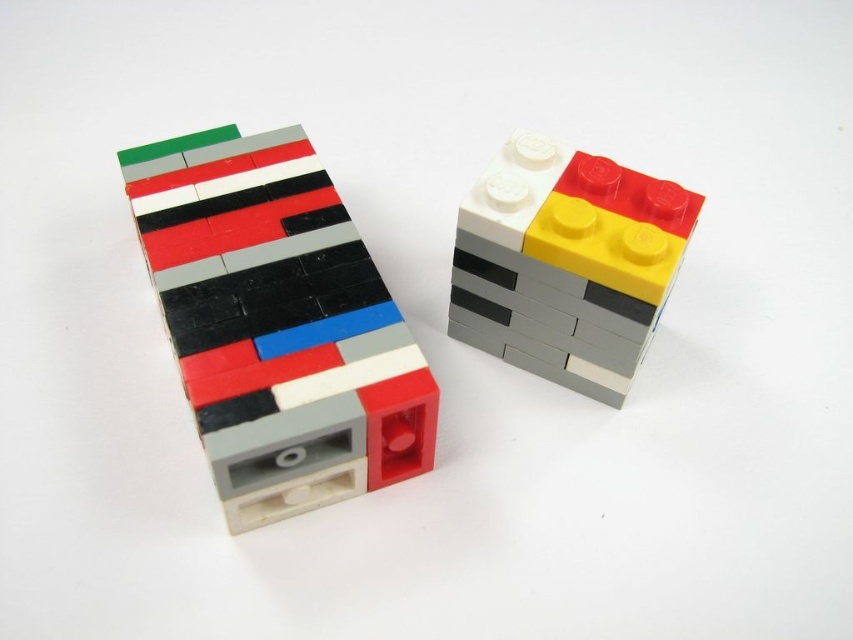
Which is above, matte plastic bricks at left or matte plastic brick at upper right?

matte plastic brick at upper right is above.

Where is `matte plastic bricks at left`? This screenshot has width=853, height=640. matte plastic bricks at left is located at coordinates (277, 323).

Find the location of a particular element. This screenshot has width=853, height=640. matte plastic bricks at left is located at coordinates (277, 323).